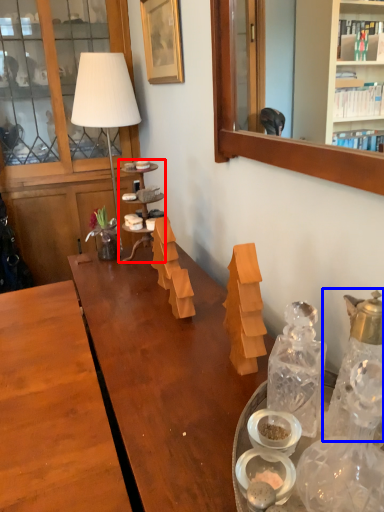
Question: Which of the following is the closest to the observer, shelf (highlighted by a red box) or bottle (highlighted by a blue box)?

Choices:
 (A) shelf
 (B) bottle

Answer: (B)